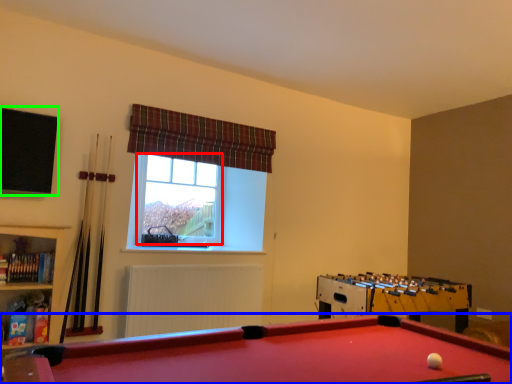
Question: Which object is positioned farthest from bay window (highlighted by a red box)? Select from billiard table (highlighted by a blue box) and window screen (highlighted by a green box).

Choices:
 (A) billiard table
 (B) window screen

Answer: (A)